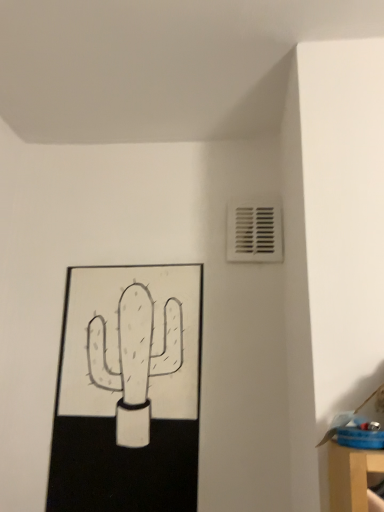
Question: Is white plastic vent at upper right in front of or behind black matte picture frame at lower left in the image?

Choices:
 (A) front
 (B) behind

Answer: (B)

Question: Considering the positions of white plastic vent at upper right and black matte picture frame at lower left in the image, is white plastic vent at upper right bigger or smaller than black matte picture frame at lower left?

Choices:
 (A) small
 (B) big

Answer: (A)

Question: Considering the positions of white plastic vent at upper right and black matte picture frame at lower left in the image, is white plastic vent at upper right taller or shorter than black matte picture frame at lower left?

Choices:
 (A) short
 (B) tall

Answer: (A)

Question: Considering the positions of black matte picture frame at lower left and white plastic vent at upper right in the image, is black matte picture frame at lower left wider or thinner than white plastic vent at upper right?

Choices:
 (A) thin
 (B) wide

Answer: (B)

Question: Is black matte picture frame at lower left spatially inside white plastic vent at upper right, or outside of it?

Choices:
 (A) outside
 (B) inside

Answer: (A)

Question: In terms of size, does black matte picture frame at lower left appear bigger or smaller than white plastic vent at upper right?

Choices:
 (A) small
 (B) big

Answer: (B)

Question: Based on their positions, is black matte picture frame at lower left located to the left or right of white plastic vent at upper right?

Choices:
 (A) right
 (B) left

Answer: (B)